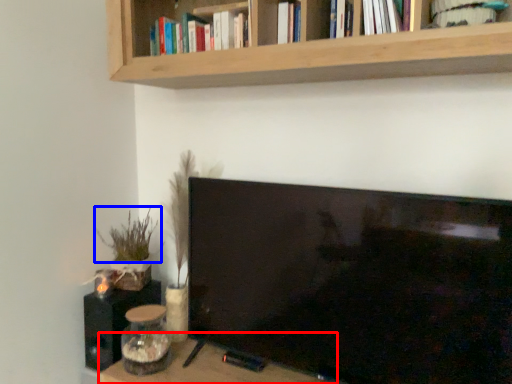
Question: Which object is closer to the camera taking this photo, table (highlighted by a red box) or plant (highlighted by a blue box)?

Choices:
 (A) table
 (B) plant

Answer: (A)